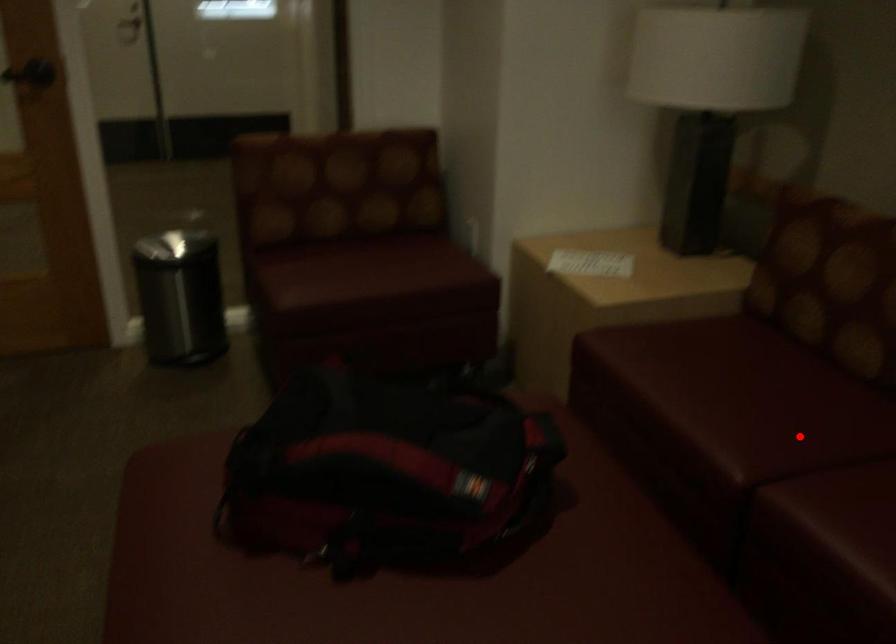
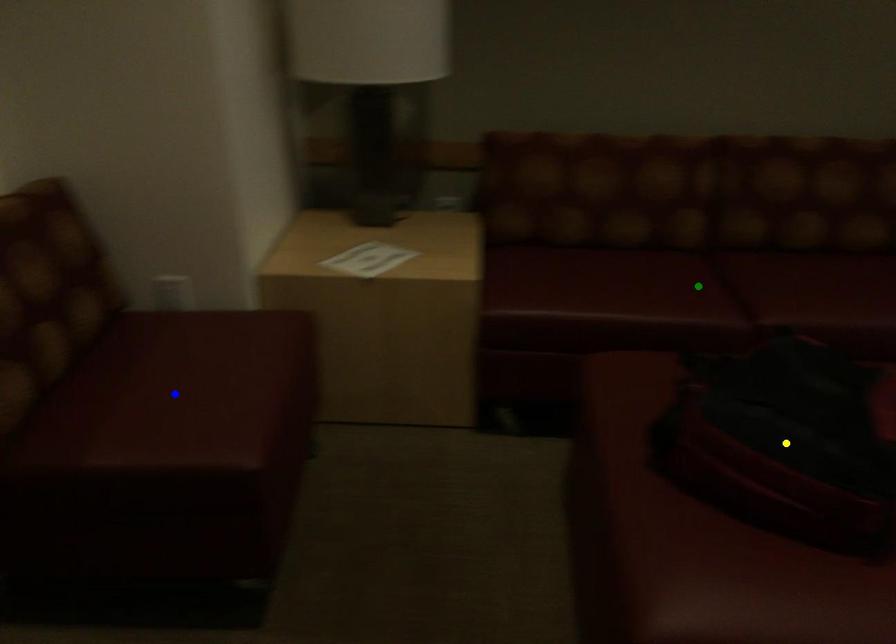
Question: I am providing you with two images of the same scene from different viewpoints. A red point is marked on the first image. You are given multiple points on the second image. Can you choose the point in image 2 that corresponds to the point in image 1?

Choices:
 (A) yellow point
 (B) blue point
 (C) green point

Answer: (C)